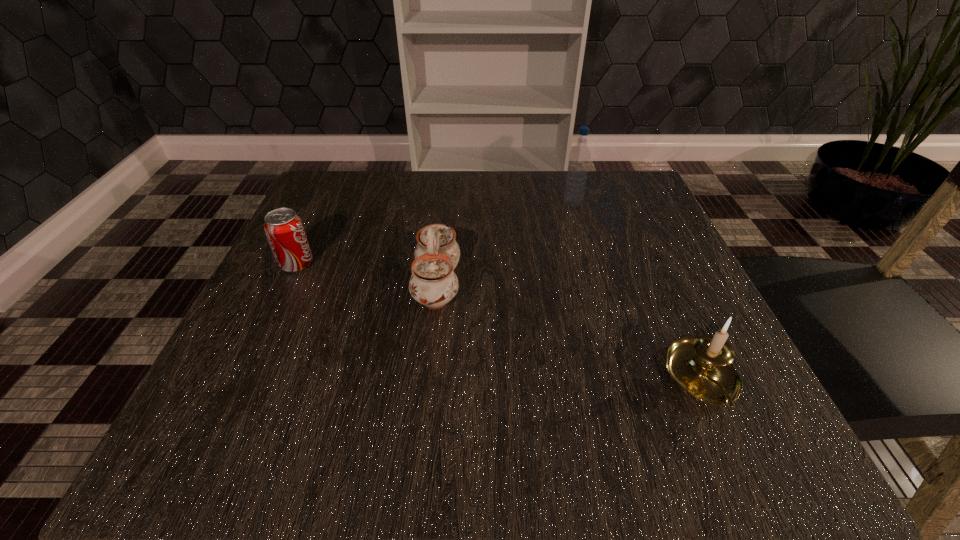
At what (x,y) coordinates should I click in order to perform the action: click on free space between the third object from right to left and the farthest object. Please return your answer as a coordinate pair (x, y). The height and width of the screenshot is (540, 960). Looking at the image, I should click on (505, 244).

Locate an element on the screen. vacant region between the chinaware and the leftmost object is located at coordinates (367, 274).

The width and height of the screenshot is (960, 540). I want to click on object that can be found as the second closest to the tallest object, so click(x=703, y=366).

I want to click on the second closest object to the tallest object, so click(703, 366).

Identify the location of vacant space that satisfies the following two spatial constraints: 1. on the front side of the tallest object; 2. by the handle of the chinaware. The height and width of the screenshot is (540, 960). (596, 285).

This screenshot has width=960, height=540. In order to click on vacant region that satisfies the following two spatial constraints: 1. on the front side of the third object from left to right; 2. by the handle of the chinaware in this screenshot , I will do `click(596, 285)`.